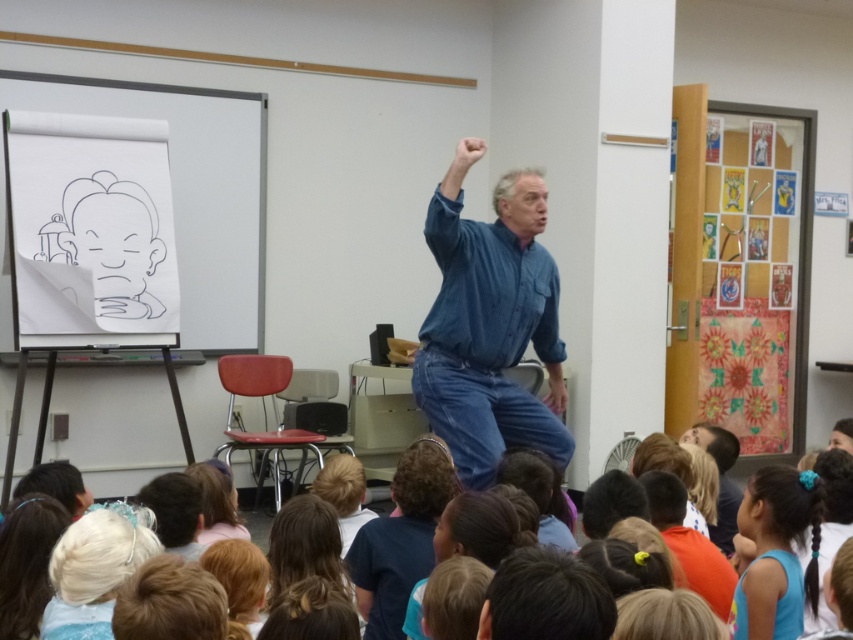
Where is `denim shirt at center`? denim shirt at center is located at coordinates (489, 323).

Can you confirm if denim shirt at center is smaller than matte blue shirt at center?

No, denim shirt at center is not smaller than matte blue shirt at center.

Identify the location of denim shirt at center. (489, 323).

Between point (743, 609) and point (730, 499), which one is positioned behind?

Point (730, 499)

Image resolution: width=853 pixels, height=640 pixels. What do you see at coordinates (776, 554) in the screenshot?
I see `blue fabric hairband at lower right` at bounding box center [776, 554].

Identify the location of blue fabric hairband at lower right. (776, 554).

Is denim shirt at center further to camera compared to blue fabric hairband at lower right?

Yes, denim shirt at center is behind blue fabric hairband at lower right.

Does point (519, 314) lie behind point (743, 522)?

Yes, it is.

This screenshot has height=640, width=853. I want to click on denim shirt at center, so click(x=489, y=323).